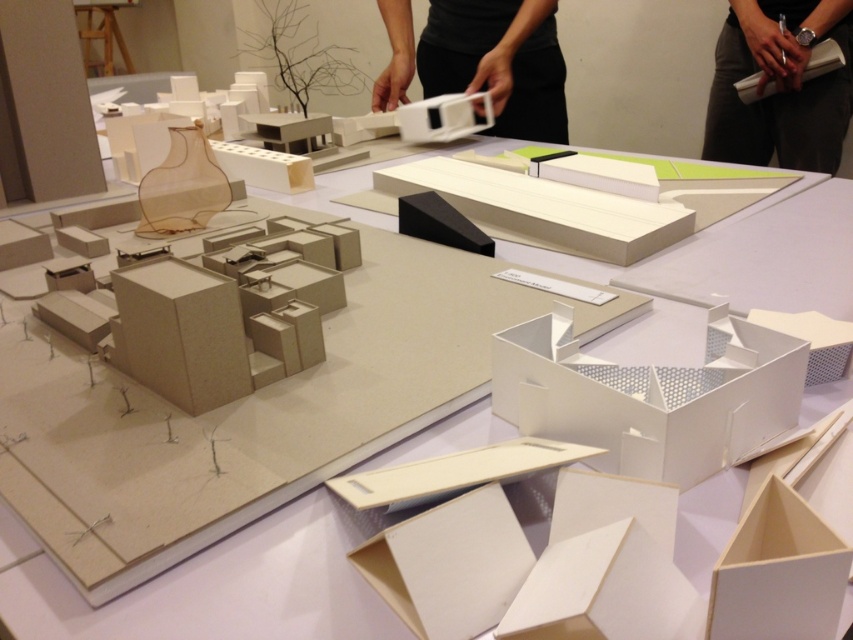
Question: Which point is closer to the camera?

Choices:
 (A) (770, 134)
 (B) (541, 48)

Answer: (B)

Question: Where is black fabric at upper right located in relation to matte white plastic model at upper center in the image?

Choices:
 (A) below
 (B) above

Answer: (B)

Question: Which of the following is the farthest from the observer?

Choices:
 (A) (798, 86)
 (B) (500, 128)

Answer: (B)

Question: Considering the relative positions of black fabric at upper right and matte white plastic model at upper center in the image provided, where is black fabric at upper right located with respect to matte white plastic model at upper center?

Choices:
 (A) below
 (B) above

Answer: (B)

Question: Is black fabric at upper right thinner than matte white plastic model at upper center?

Choices:
 (A) no
 (B) yes

Answer: (B)